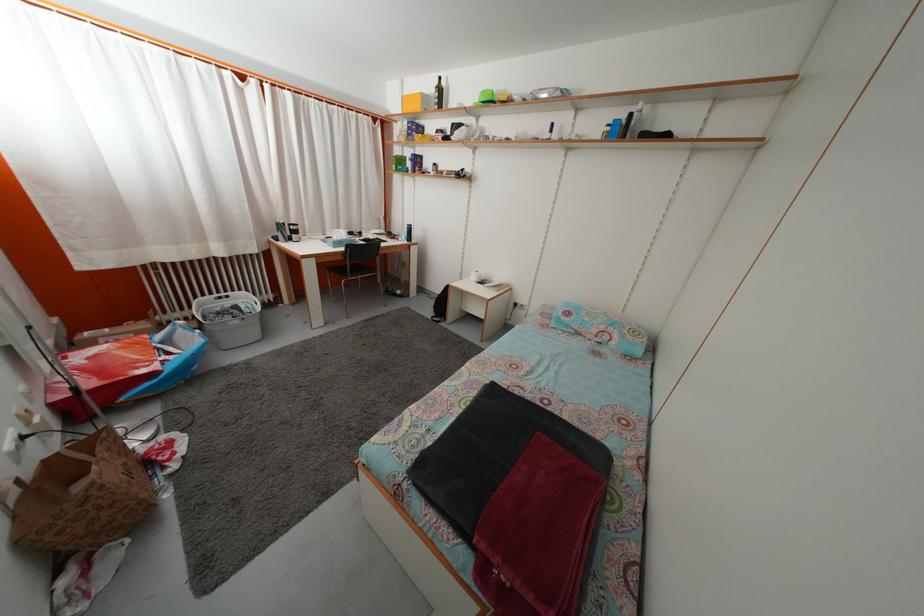
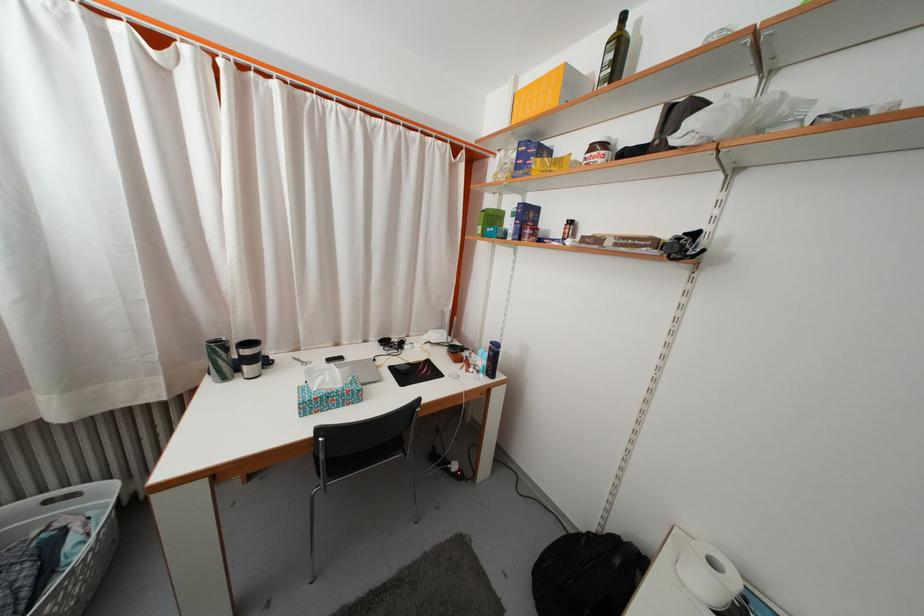
Find the pixel in the second image that matches [430,105] in the first image.

(575, 84)